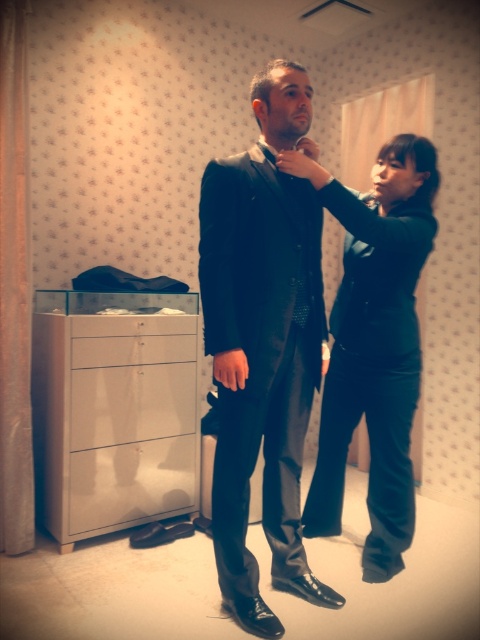
Question: Is white glossy/file cabinet at lower left behind velvet black pants at center?

Choices:
 (A) no
 (B) yes

Answer: (B)

Question: Can you confirm if white glossy/file cabinet at lower left is thinner than velvet black pants at center?

Choices:
 (A) yes
 (B) no

Answer: (B)

Question: Considering the real-world distances, which object is farthest from the black shiny suit at center?

Choices:
 (A) white glossy/file cabinet at lower left
 (B) velvet black pants at center

Answer: (A)

Question: Is white glossy/file cabinet at lower left above velvet black pants at center?

Choices:
 (A) yes
 (B) no

Answer: (B)

Question: Which object is the closest to the white glossy/file cabinet at lower left?

Choices:
 (A) velvet black pants at center
 (B) black shiny suit at center

Answer: (B)

Question: Which of the following is the farthest from the observer?

Choices:
 (A) (156, 340)
 (B) (337, 356)

Answer: (A)